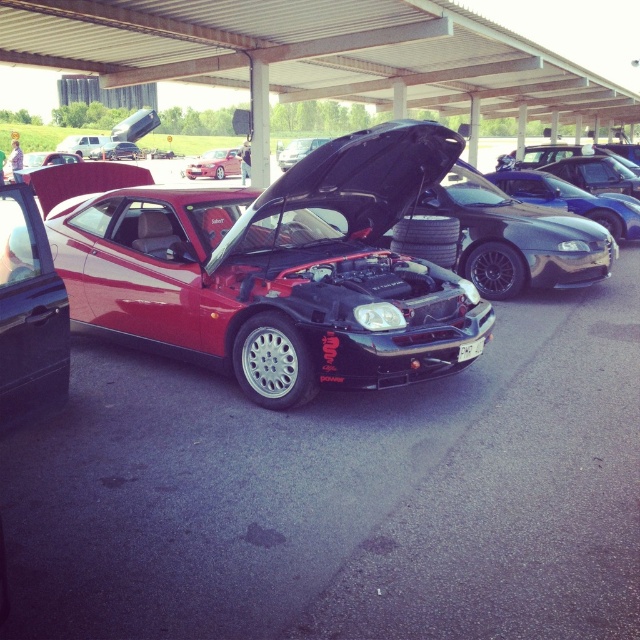
Question: Does shiny metallic car at center have a smaller size compared to matte black car at center?

Choices:
 (A) yes
 (B) no

Answer: (B)

Question: Among these objects, which one is nearest to the camera?

Choices:
 (A) shiny metallic car at center
 (B) glossy black car at center
 (C) matte black car at center

Answer: (B)

Question: Does shiny metallic car at center appear on the right side of glossy black car at center?

Choices:
 (A) yes
 (B) no

Answer: (B)

Question: Which point is farther from the camera taking this photo?

Choices:
 (A) (308, 138)
 (B) (106, 147)

Answer: (B)

Question: Considering the relative positions of shiny metallic car at center and matte black car at center in the image provided, where is shiny metallic car at center located with respect to matte black car at center?

Choices:
 (A) right
 (B) left

Answer: (A)

Question: Considering the real-world distances, which object is farthest from the glossy black car at center?

Choices:
 (A) shiny metallic car at center
 (B) matte black car at center

Answer: (B)